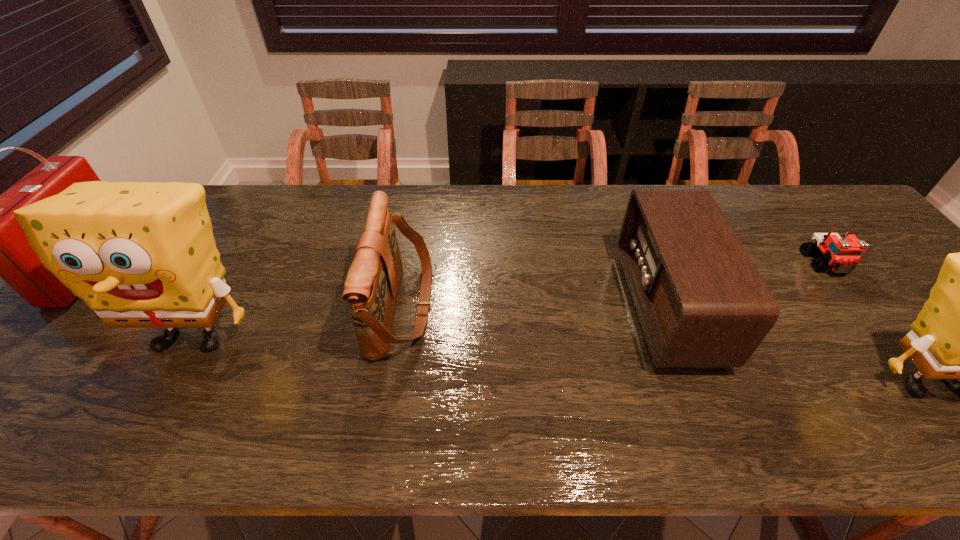
Identify the location of the second object from left to right. Image resolution: width=960 pixels, height=540 pixels. (140, 255).

The width and height of the screenshot is (960, 540). What are the coordinates of `the taller sponge` in the screenshot? It's located at (140, 255).

At what (x,y) coordinates should I click in order to perform the action: click on the first-aid kit. Please return your answer as a coordinate pair (x, y). Looking at the image, I should click on (0, 248).

The width and height of the screenshot is (960, 540). I want to click on radio receiver, so click(701, 302).

Locate an element on the screen. The width and height of the screenshot is (960, 540). the fourth object from right to left is located at coordinates (371, 287).

Identify the location of Lego. The height and width of the screenshot is (540, 960). (841, 255).

The height and width of the screenshot is (540, 960). Identify the location of vacant space located on the face of the left sponge. (160, 397).

I want to click on blank area located 0.240m on the front face of the leftmost object, so click(x=198, y=267).

Image resolution: width=960 pixels, height=540 pixels. Identify the location of vacant space located 0.360m on the front-facing side of the third object from right to left. (484, 306).

Find the location of a particular element. vacant space located 0.360m on the front-facing side of the third object from right to left is located at coordinates (484, 306).